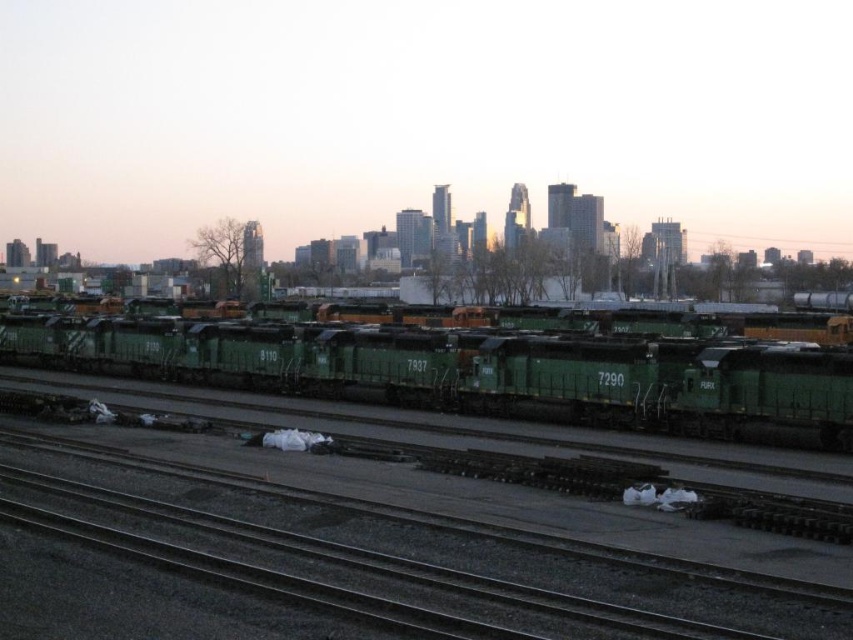
You are a railway worker who needs to place a new signal light between the black asphalt train track at lower center and the green matte train at center. Which object should the signal light be placed closer to, based on their sizes?

The signal light should be placed closer to the black asphalt train track at lower center because it has a smaller size compared to the green matte train at center.

You are standing at the origin point of the coordinate system. You want to walk to the black asphalt train track at lower center. Which direction should you walk to reach it?

The black asphalt train track at lower center is located at coordinate point 0.878 on the x axis and 0.478 on the y axis. Since you are at the origin point, you should walk in the positive x and y direction to reach it.

You are a railway inspector standing at the black asphalt train track at lower center. You need to reach the green matte train at center for inspection. Can you walk directly to the train along the track without needing to go around any obstacles?

The black asphalt train track at lower center is 58.27 feet from the green matte train at center. Since the track is a straight path, you can walk directly to the train along the track without needing to go around any obstacles.